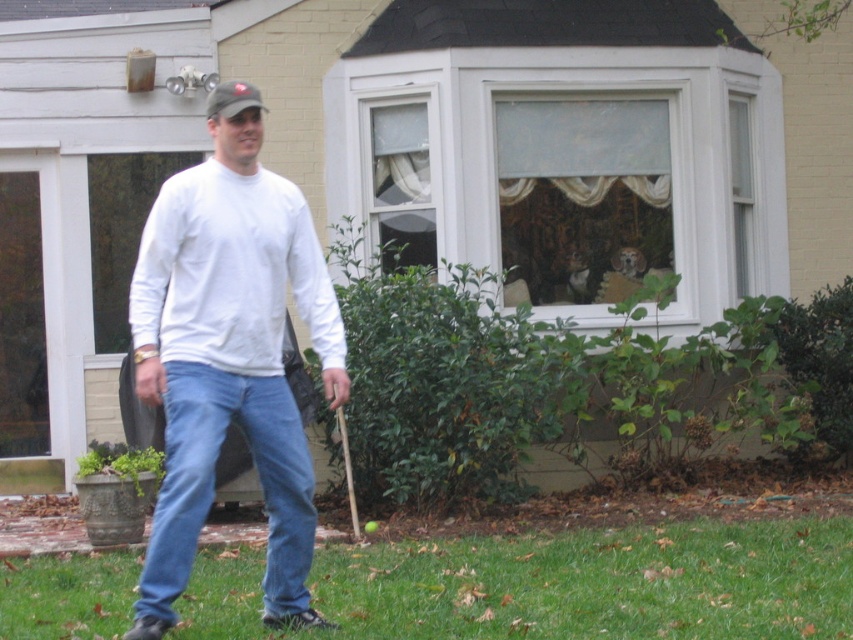
Question: Does white cotton shirt at center have a smaller size compared to blue denim jeans at lower center?

Choices:
 (A) no
 (B) yes

Answer: (A)

Question: Which point is farther to the camera?

Choices:
 (A) [x=201, y=273]
 (B) [x=158, y=513]
 (C) [x=509, y=576]

Answer: (C)

Question: Is white cotton shirt at center bigger than blue denim jeans at lower center?

Choices:
 (A) yes
 (B) no

Answer: (A)

Question: Is green grass at lower center above white cotton shirt at center?

Choices:
 (A) yes
 (B) no

Answer: (B)

Question: Based on their relative distances, which object is nearer to the white cotton shirt at center?

Choices:
 (A) blue denim jeans at lower center
 (B) green grass at lower center

Answer: (A)

Question: Which point is farther to the camera?

Choices:
 (A) white cotton shirt at center
 (B) blue denim jeans at lower center

Answer: (A)